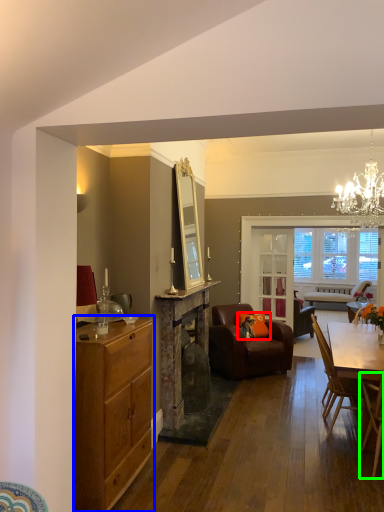
Question: Based on their relative distances, which object is nearer to pillow (highlighted by a red box)? Choose from cabinetry (highlighted by a blue box) and chair (highlighted by a green box).

Choices:
 (A) cabinetry
 (B) chair

Answer: (B)